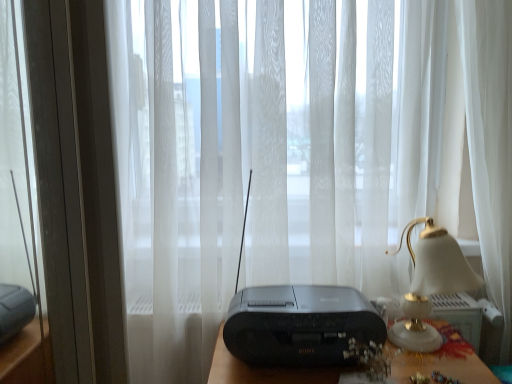
Question: Based on their positions, is black plastic radio at center located to the left or right of matte gold lampshade at right?

Choices:
 (A) left
 (B) right

Answer: (A)

Question: In terms of size, does black plastic radio at center appear bigger or smaller than matte gold lampshade at right?

Choices:
 (A) big
 (B) small

Answer: (B)

Question: Which of these objects is positioned closest to the matte gold lampshade at right?

Choices:
 (A) transparent glass door at left
 (B) black plastic radio at center
 (C) black plastic radio at center

Answer: (C)

Question: Which of these objects is positioned closest to the matte gold lampshade at right?

Choices:
 (A) black plastic radio at center
 (B) black plastic radio at center
 (C) transparent glass door at left

Answer: (A)